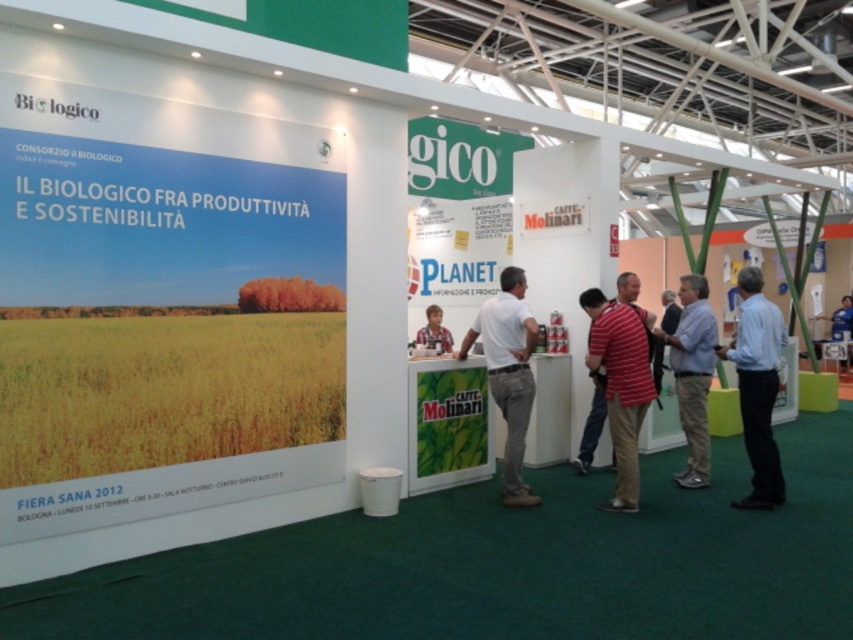
Question: Among these objects, which one is farthest from the camera?

Choices:
 (A) blue shirt at right
 (B) white matte shirt at center
 (C) light brown wooden chair at center
 (D) light blue shirt at center

Answer: (C)

Question: Among these points, which one is farthest from the camera?

Choices:
 (A) (445, 330)
 (B) (521, 323)
 (C) (830, 324)

Answer: (C)

Question: Which object appears closest to the camera in this image?

Choices:
 (A) blue shirt at right
 (B) white matte shirt at center
 (C) striped cotton shirt at center

Answer: (A)

Question: Is striped cotton shirt at center above light brown wooden chair at center?

Choices:
 (A) yes
 (B) no

Answer: (B)

Question: Does striped cotton shirt at center have a smaller size compared to light blue shirt at center?

Choices:
 (A) no
 (B) yes

Answer: (B)

Question: Does striped cotton shirt at center have a lesser width compared to white matte shirt at center?

Choices:
 (A) no
 (B) yes

Answer: (B)